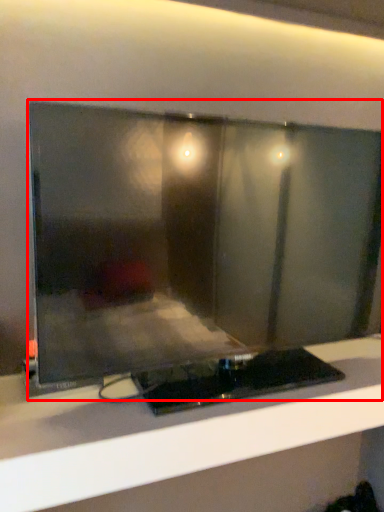
Question: From the image's perspective, what is the correct spatial relationship of computer monitor (annotated by the red box) in relation to furniture?

Choices:
 (A) above
 (B) below

Answer: (A)